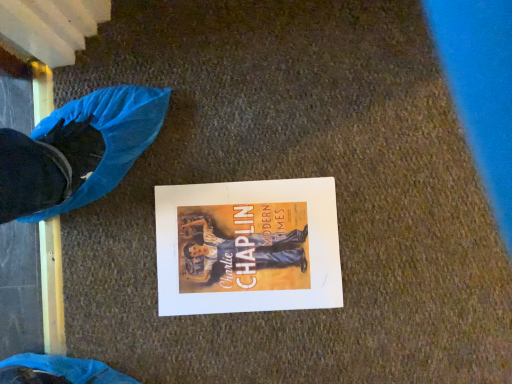
Find the location of a particular element. This screenshot has height=384, width=512. vacant point above white paper poster at center (from a real-world perspective) is located at coordinates point(253,248).